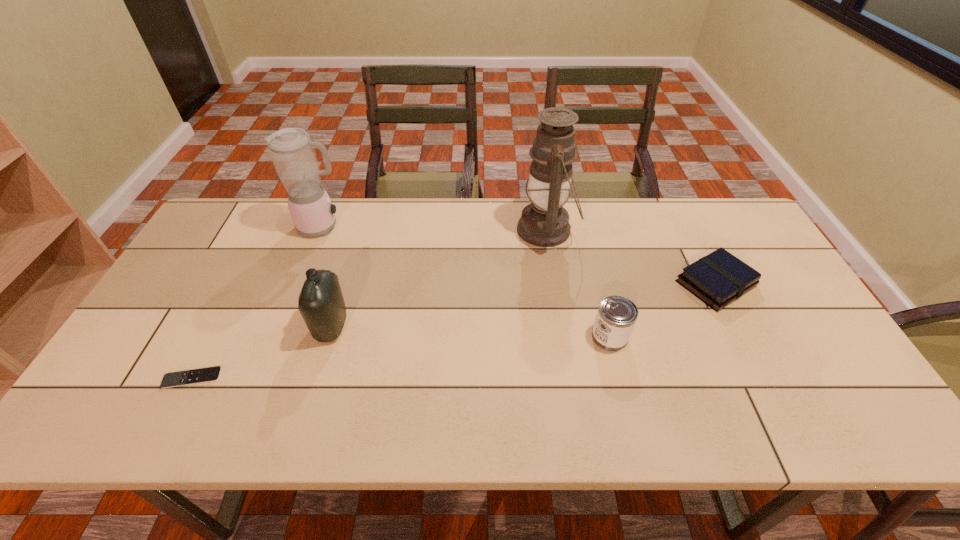
Where is `blank region between the rightmost object and the oil lamp`? blank region between the rightmost object and the oil lamp is located at coordinates (631, 256).

At what (x,y) coordinates should I click in order to perform the action: click on blank region between the fourth object from right to left and the remote control. Please return your answer as a coordinate pair (x, y). Image resolution: width=960 pixels, height=540 pixels. Looking at the image, I should click on (262, 352).

Image resolution: width=960 pixels, height=540 pixels. In order to click on free space between the second object from left to right and the rightmost object in this screenshot , I will do `click(519, 255)`.

You are a GUI agent. You are given a task and a screenshot of the screen. Output one action in this format:
    pyautogui.click(x=<x>, y=<y>)
    Task: Click on the vacant area that lies between the third shortest object and the bottle
    
    Given the screenshot: What is the action you would take?
    pyautogui.click(x=470, y=332)

Locate which object is the fifth closest to the remote control. Please provide its 2D coordinates. Your answer should be formatted as a tuple, i.e. [(x, y)], where the tuple contains the x and y coordinates of a point satisfying the conditions above.

[(719, 278)]

Where is `object that ranks as the fourth closest to the bottle`? This screenshot has width=960, height=540. object that ranks as the fourth closest to the bottle is located at coordinates (617, 315).

This screenshot has width=960, height=540. I want to click on vacant space that satisfies the following two spatial constraints: 1. on the back side of the remote control; 2. on the left side of the fourth tallest object, so click(x=213, y=336).

The width and height of the screenshot is (960, 540). Identify the location of vacant space that satisfies the following two spatial constraints: 1. on the base of the third shortest object near the control knob; 2. on the left side of the food processor. (279, 336).

You are a GUI agent. You are given a task and a screenshot of the screen. Output one action in this format:
    pyautogui.click(x=<x>, y=<y>)
    Task: Click on the free space that satisfies the following two spatial constraints: 1. on the base of the food processor near the control knob; 2. on the back side of the bottle
    The height and width of the screenshot is (540, 960).
    Given the screenshot: What is the action you would take?
    pyautogui.click(x=283, y=327)

Locate an element on the screen. Image resolution: width=960 pixels, height=540 pixels. vacant space that satisfies the following two spatial constraints: 1. on the base of the food processor near the control knob; 2. on the left side of the oil lamp is located at coordinates (321, 230).